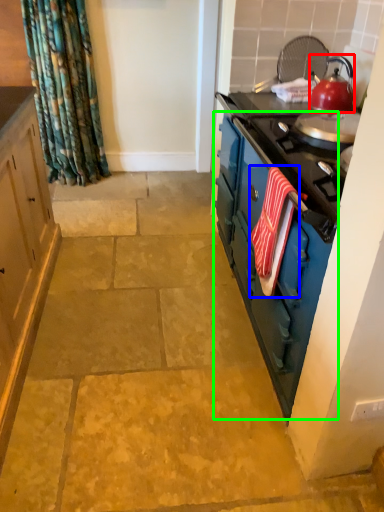
Question: Considering the real-world distances, which object is closest to kitchen appliance (highlighted by a red box)? beach towel (highlighted by a blue box) or dresser (highlighted by a green box).

Choices:
 (A) beach towel
 (B) dresser

Answer: (B)